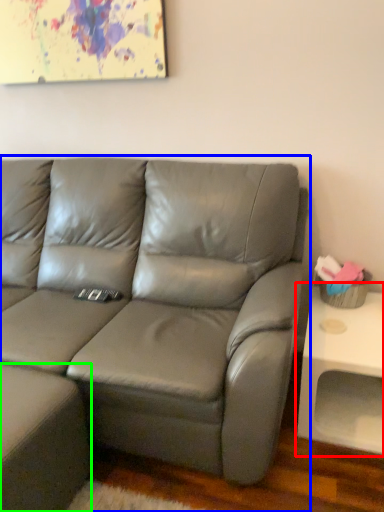
Question: Estimate the real-world distances between objects in this image. Which object is farther from table (highlighted by a red box), studio couch (highlighted by a blue box) or footrest (highlighted by a green box)?

Choices:
 (A) studio couch
 (B) footrest

Answer: (B)